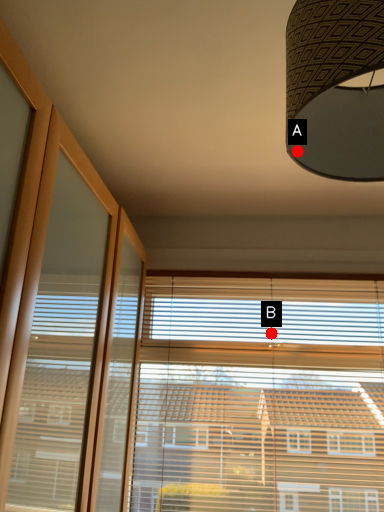
Question: Two points are circled on the image, labeled by A and B beside each circle. Which point is closer to the camera taking this photo?

Choices:
 (A) A is closer
 (B) B is closer

Answer: (A)